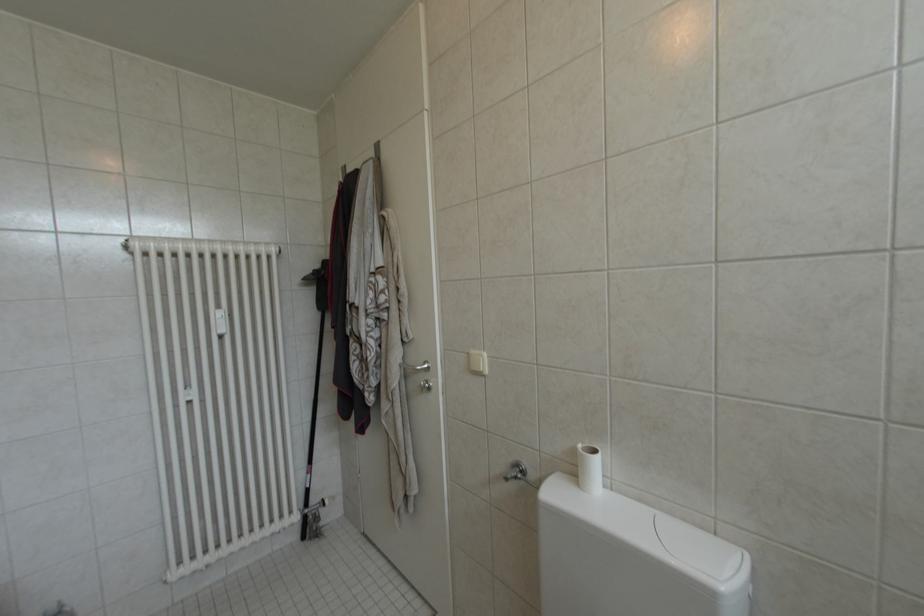
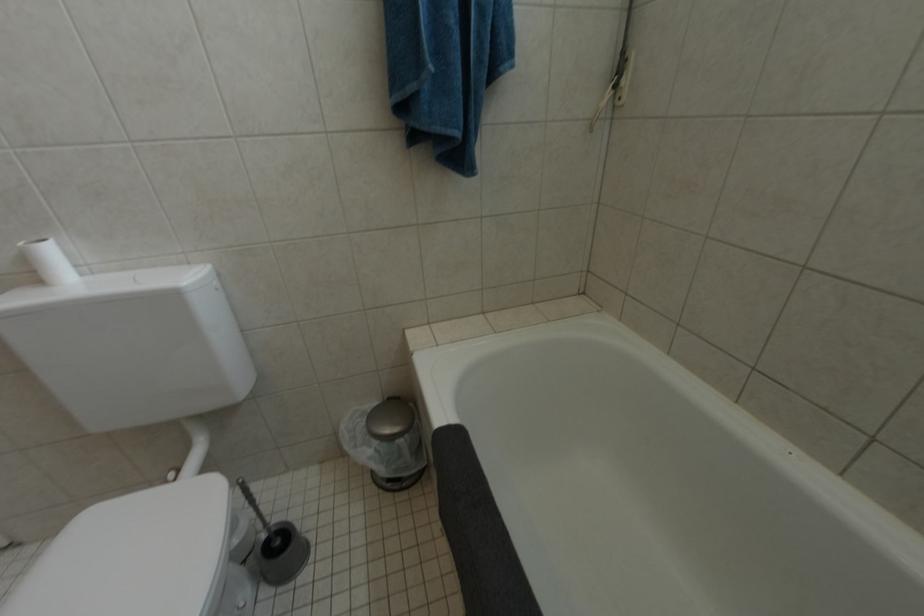
How did the camera likely rotate?

The camera rotated toward right-down.